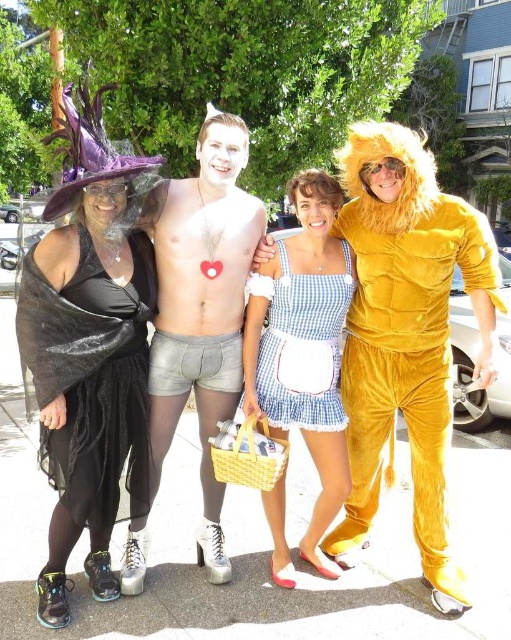
Between point (228, 413) and point (129, 476), which one is positioned behind?

Point (228, 413)

Who is lower down, metallic silver shorts at center or black mesh dress at left?

black mesh dress at left is lower down.

Between point (228, 570) and point (126, 362), which one is positioned behind?

The point (228, 570) is behind.

I want to click on metallic silver shorts at center, so click(202, 308).

How far apart are velvet yellow lion at right and metallic silver shorts at center?

They are 29.32 inches apart.

Between velvet yellow lion at right and metallic silver shorts at center, which one appears on the right side from the viewer's perspective?

From the viewer's perspective, velvet yellow lion at right appears more on the right side.

What do you see at coordinates (406, 336) in the screenshot? The image size is (511, 640). I see `velvet yellow lion at right` at bounding box center [406, 336].

Find the location of a particular element. This screenshot has height=640, width=511. velvet yellow lion at right is located at coordinates (406, 336).

Does metallic silver shorts at center have a larger size compared to blue checkered dress at center?

Yes.

Between point (236, 292) and point (294, 355), which one is positioned behind?

The point (236, 292) is behind.

Is point (212, 364) closer to camera compared to point (276, 337)?

That is True.

Identify the location of metallic silver shorts at center. The image size is (511, 640). (202, 308).